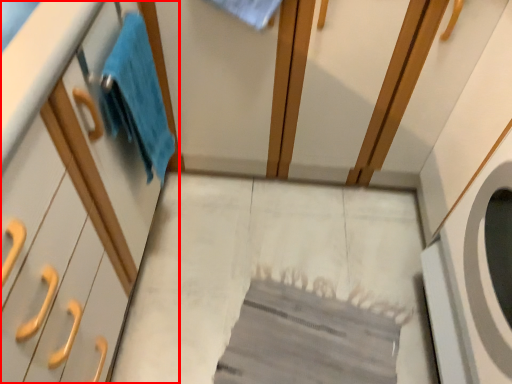
Question: From the image's perspective, what is the correct spatial positioning of cabinetry (annotated by the red box) in reference to bath towel?

Choices:
 (A) below
 (B) above

Answer: (A)